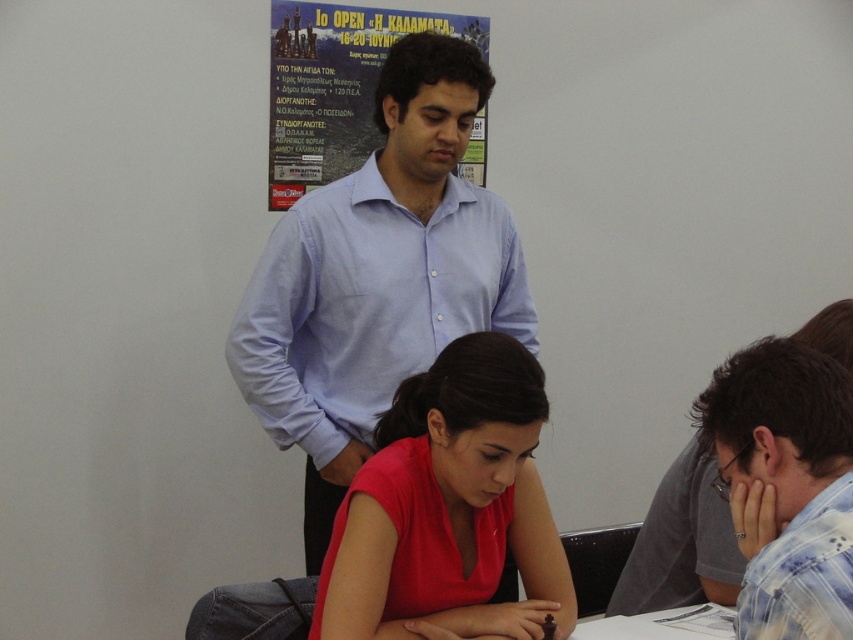
You are organizing a photo shoot and need to place two shirts on a display rack. The light blue shirt at upper center and the blue plaid shirt at lower right. Which shirt should be placed on the wider rack space?

The light blue shirt at upper center should be placed on the wider rack space because its width surpasses that of the blue plaid shirt at lower right.

You are standing at point (267, 252) in the image. You want to take a photo of the poster on the wall. The camera you have can focus on objects up to 2.5 meters away. Can you take a clear photo of the poster without moving?

The distance between point (267, 252) and the camera is 2.39 meters, which is within the camera focus range of 2.5 meters. Therefore, you can take a clear photo of the poster without moving.